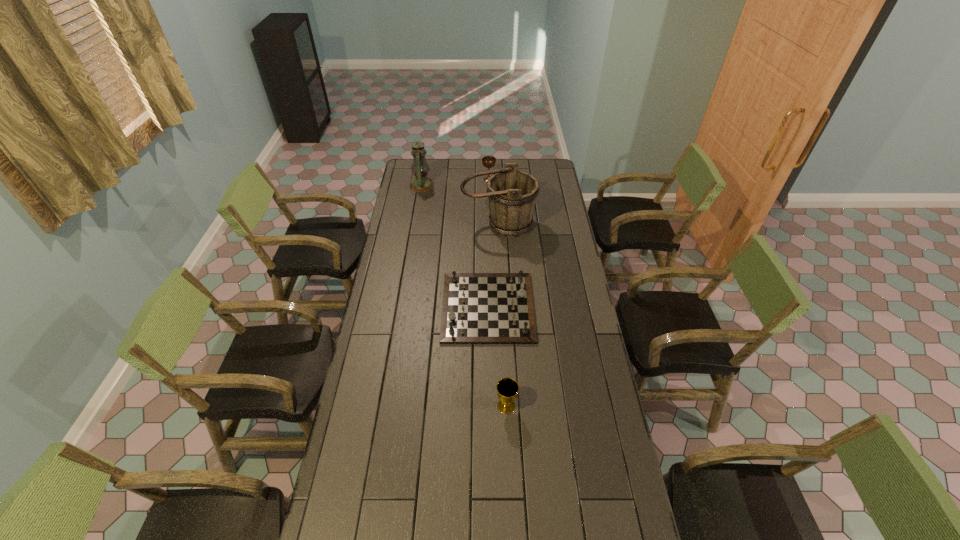
This screenshot has height=540, width=960. I want to click on empty space between the nearest object and the shortest object, so click(x=497, y=356).

Where is `free point between the chessboard and the bucket`? free point between the chessboard and the bucket is located at coordinates (493, 266).

Identify which object is the fourth nearest to the third nearest object. Please provide its 2D coordinates. Your answer should be formatted as a tuple, i.e. [(x, y)], where the tuple contains the x and y coordinates of a point satisfying the conditions above.

[(507, 388)]

Locate which object is the closest to the farther chalice. Please provide its 2D coordinates. Your answer should be formatted as a tuple, i.e. [(x, y)], where the tuple contains the x and y coordinates of a point satisfying the conditions above.

[(512, 194)]

The image size is (960, 540). I want to click on free space that satisfies the following two spatial constraints: 1. on the board of the chessboard; 2. on the left side of the nearer chalice, so click(490, 406).

This screenshot has height=540, width=960. In order to click on free spot that satisfies the following two spatial constraints: 1. on the back side of the farther chalice; 2. on the left side of the leftmost object in this screenshot , I will do `click(423, 179)`.